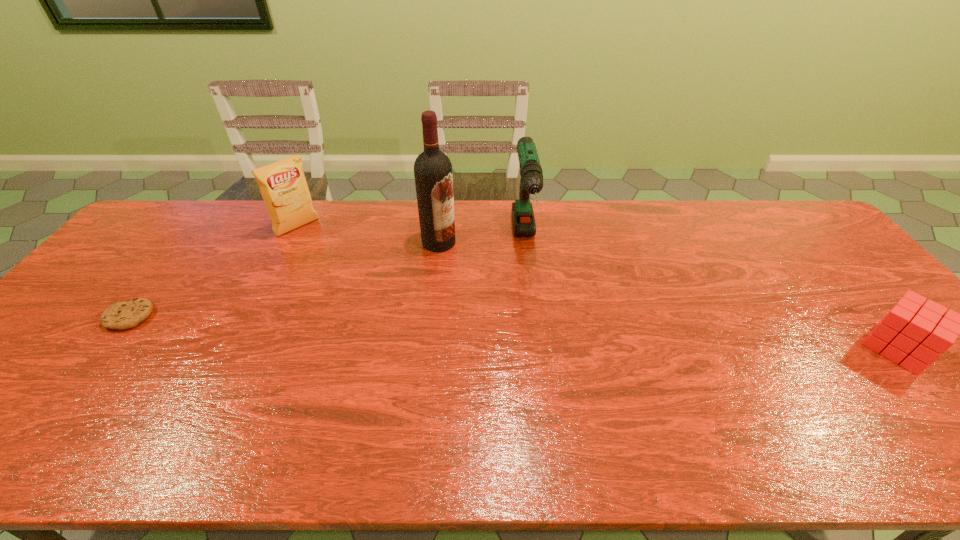
At what (x,y) coordinates should I click in order to perform the action: click on cookie. Please return your answer as a coordinate pair (x, y). Image resolution: width=960 pixels, height=540 pixels. Looking at the image, I should click on (122, 315).

Find the location of a particular element. the shortest object is located at coordinates (122, 315).

Locate an element on the screen. This screenshot has width=960, height=540. cube is located at coordinates (917, 333).

Identify the location of the rightmost object. (917, 333).

Where is `the second object from right to left`? The width and height of the screenshot is (960, 540). the second object from right to left is located at coordinates (531, 173).

This screenshot has height=540, width=960. What are the coordinates of `drill` in the screenshot? It's located at coord(531,173).

At what (x,y) coordinates should I click in order to perform the action: click on wine bottle. Please return your answer as a coordinate pair (x, y). This screenshot has height=540, width=960. Looking at the image, I should click on (433, 175).

Find the location of a particular element. Image resolution: width=960 pixels, height=540 pixels. the third object from right to left is located at coordinates (433, 175).

What are the coordinates of `crisp (potato chip)` in the screenshot? It's located at (283, 186).

The width and height of the screenshot is (960, 540). I want to click on the third tallest object, so click(x=283, y=186).